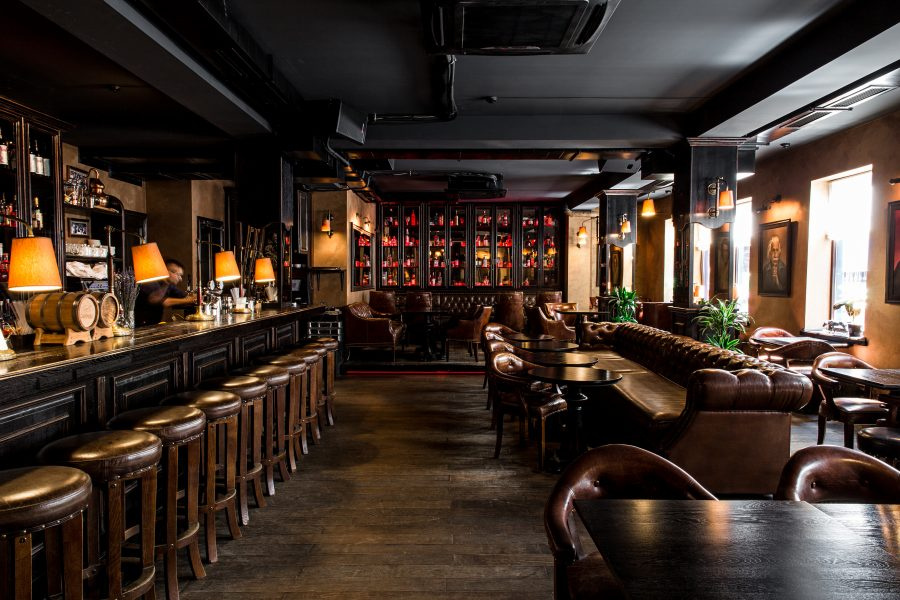
Find the location of a particular element. The width and height of the screenshot is (900, 600). brown stools is located at coordinates (50, 486), (104, 447), (174, 422), (218, 407), (257, 385), (276, 380), (293, 360), (311, 357), (321, 354), (328, 344).